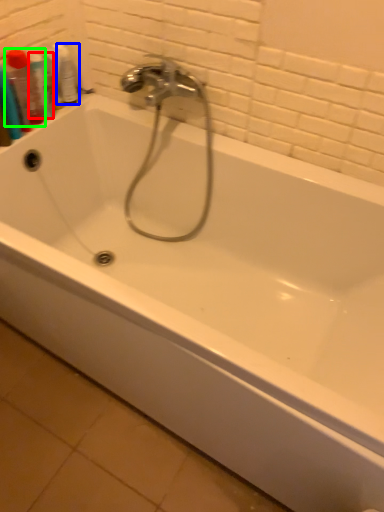
Question: Based on their relative distances, which object is farther from mouthwash (highlighted by a red box)? Choose from mouthwash (highlighted by a blue box) and mouthwash (highlighted by a green box).

Choices:
 (A) mouthwash
 (B) mouthwash

Answer: (A)